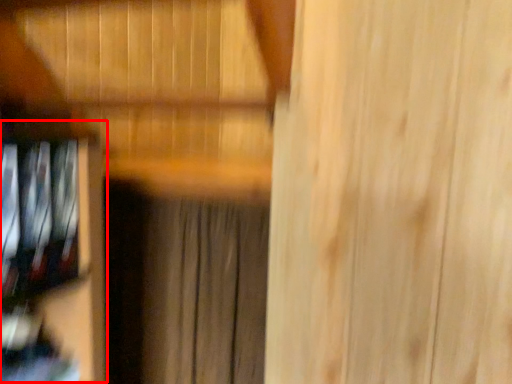
Question: Observing the image, what is the correct spatial positioning of shelf (annotated by the red box) in reference to curtain?

Choices:
 (A) left
 (B) right

Answer: (A)